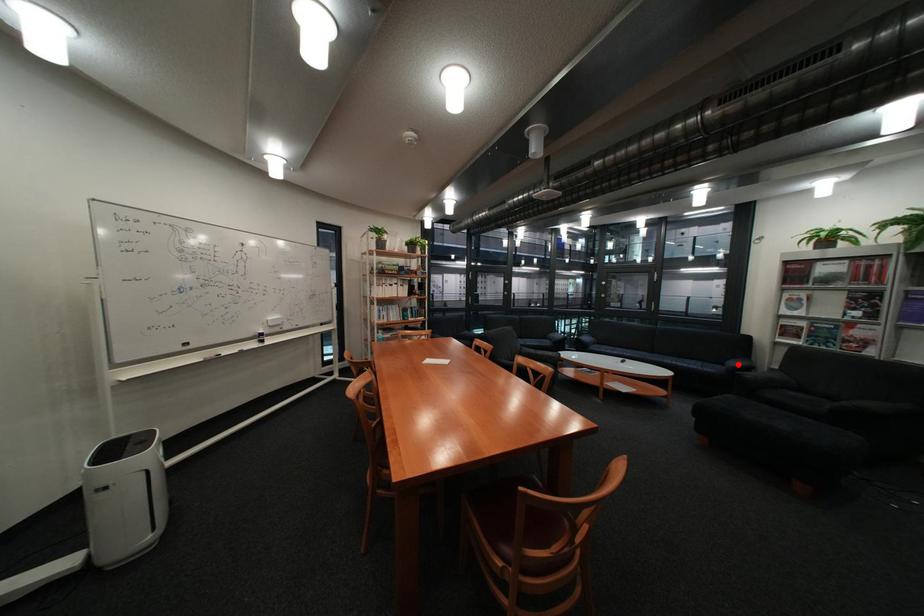
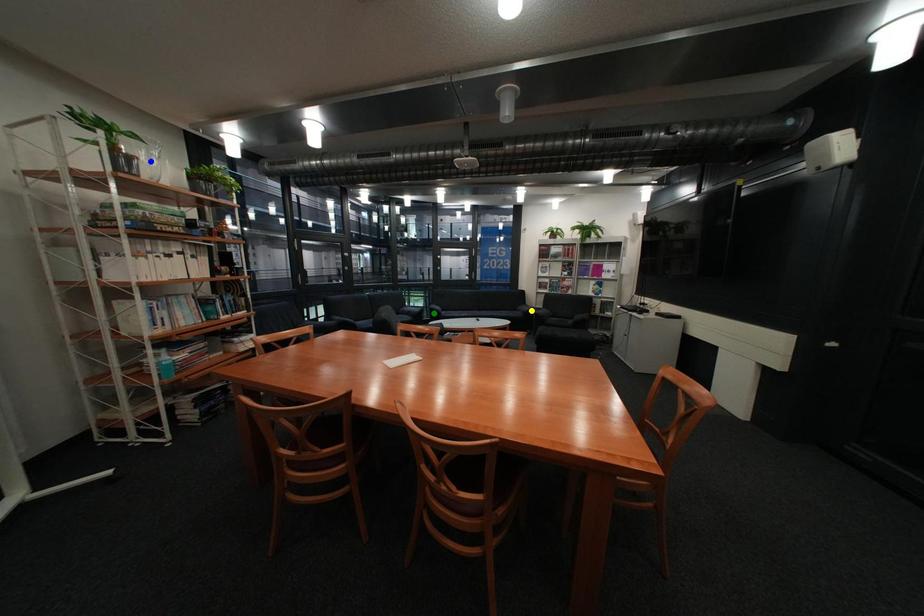
Question: I am providing you with two images of the same scene from different viewpoints. A red point is marked on the first image. You are given multiple points on the second image. Which spot in image 2 lines up with the point in image 1?

Choices:
 (A) yellow point
 (B) blue point
 (C) green point

Answer: (A)